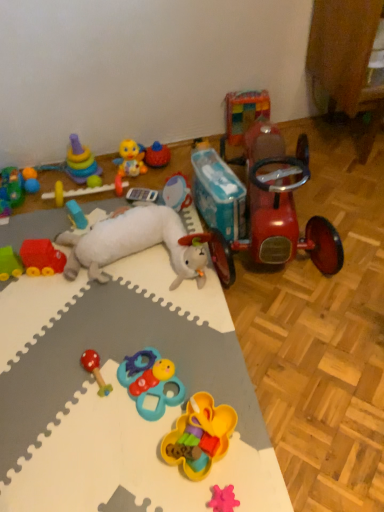
At what (x,y) coordinates should I click in order to perform the action: click on vacant point to the right of pink rubber bear at lower center, which is the 11th toy in left-to-right order. Please return your answer as a coordinate pair (x, y). This screenshot has width=384, height=512. Looking at the image, I should click on (267, 484).